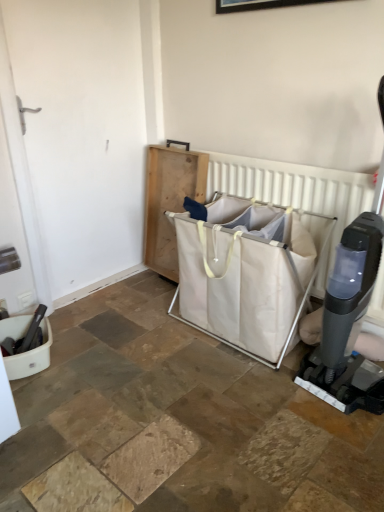
Question: Considering the relative sizes of white fabric laundry basket at center and white fabric laundry basket at center in the image provided, is white fabric laundry basket at center taller than white fabric laundry basket at center?

Choices:
 (A) yes
 (B) no

Answer: (A)

Question: Considering the relative sizes of white fabric laundry basket at center and white fabric laundry basket at center in the image provided, is white fabric laundry basket at center wider than white fabric laundry basket at center?

Choices:
 (A) no
 (B) yes

Answer: (A)

Question: Is white fabric laundry basket at center shorter than white fabric laundry basket at center?

Choices:
 (A) no
 (B) yes

Answer: (A)

Question: Is white fabric laundry basket at center with white fabric laundry basket at center?

Choices:
 (A) no
 (B) yes

Answer: (A)

Question: Is white fabric laundry basket at center oriented towards white fabric laundry basket at center?

Choices:
 (A) yes
 (B) no

Answer: (A)

Question: Relative to white fabric laundry basket at center, is light brown wooden tray at center in front or behind?

Choices:
 (A) behind
 (B) front

Answer: (A)

Question: From the image's perspective, is light brown wooden tray at center above or below white fabric laundry basket at center?

Choices:
 (A) below
 (B) above

Answer: (B)

Question: Choose the correct answer: Is light brown wooden tray at center inside white fabric laundry basket at center or outside it?

Choices:
 (A) outside
 (B) inside

Answer: (A)

Question: Does point (170, 178) appear closer or farther from the camera than point (324, 185)?

Choices:
 (A) closer
 (B) farther

Answer: (B)

Question: From their relative heights in the image, would you say white fabric laundry basket at center is taller or shorter than white fabric laundry basket at center?

Choices:
 (A) short
 (B) tall

Answer: (A)

Question: Is white fabric laundry basket at center inside or outside of white fabric laundry basket at center?

Choices:
 (A) outside
 (B) inside

Answer: (A)

Question: In the image, is white fabric laundry basket at center positioned in front of or behind white fabric laundry basket at center?

Choices:
 (A) behind
 (B) front

Answer: (B)

Question: Considering the positions of white fabric laundry basket at center and white fabric laundry basket at center in the image, is white fabric laundry basket at center bigger or smaller than white fabric laundry basket at center?

Choices:
 (A) small
 (B) big

Answer: (B)

Question: From the image's perspective, is white fabric laundry basket at center located above or below light brown wooden tray at center?

Choices:
 (A) above
 (B) below

Answer: (B)

Question: Considering the positions of point (264, 283) and point (185, 177), is point (264, 283) closer or farther from the camera than point (185, 177)?

Choices:
 (A) closer
 (B) farther

Answer: (A)